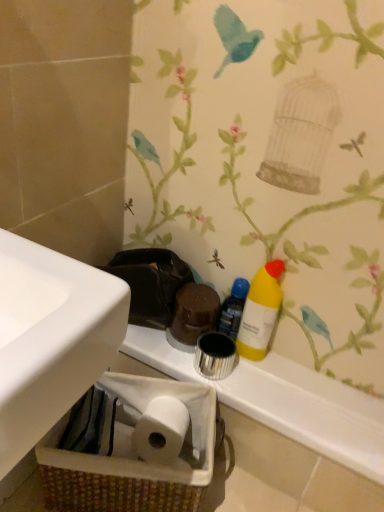
Where is `free spot above white glossy counter top at center (from a real-world perspective)`? Image resolution: width=384 pixels, height=512 pixels. free spot above white glossy counter top at center (from a real-world perspective) is located at coordinates (277, 379).